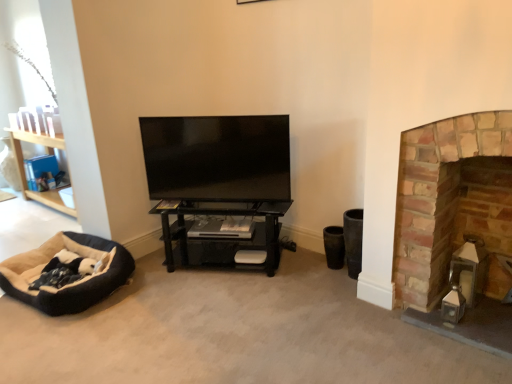
Question: From the image's perspective, is black matte shelf at center located above or below flat screen tv at center?

Choices:
 (A) below
 (B) above

Answer: (A)

Question: Which is correct: black matte shelf at center is inside flat screen tv at center, or outside of it?

Choices:
 (A) outside
 (B) inside

Answer: (A)

Question: Which object is positioned farthest from the flat screen tv at center?

Choices:
 (A) black matte shelf at center
 (B) soft beige fabric dog bed at lower left
 (C) brick fireplace at right

Answer: (C)

Question: Which of these objects is positioned farthest from the soft beige fabric dog bed at lower left?

Choices:
 (A) black matte shelf at center
 (B) flat screen tv at center
 (C) brick fireplace at right

Answer: (C)